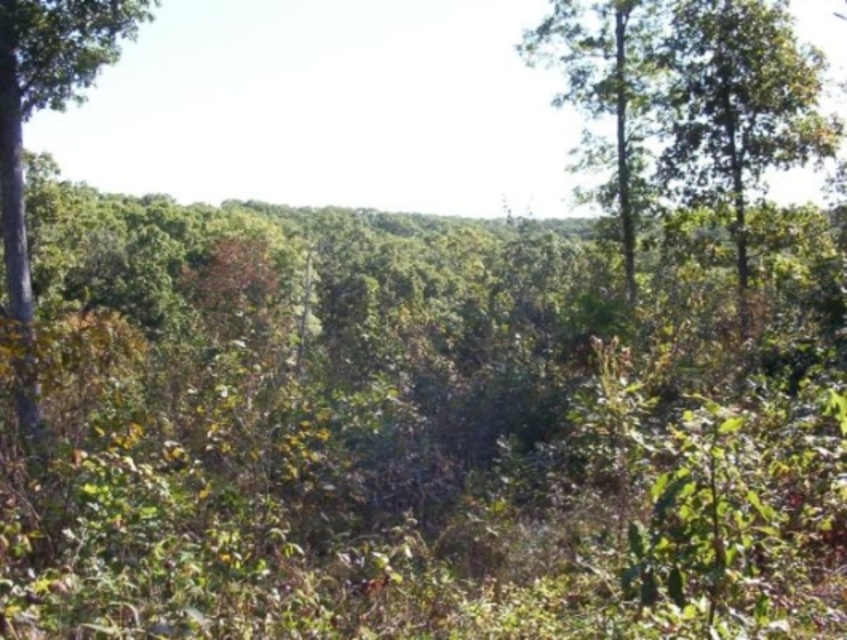
Who is shorter, green leafy tree at upper right or green leafy tree at left?

Standing shorter between the two is green leafy tree at upper right.

Between green leafy tree at upper right and green leafy tree at left, which one has more height?

green leafy tree at left is taller.

Locate an element on the screen. green leafy tree at upper right is located at coordinates (737, 104).